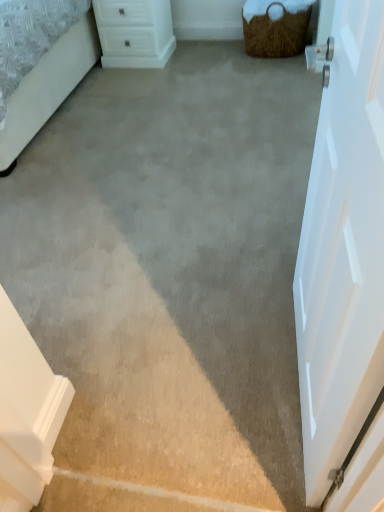
Question: Which direction should I rotate to look at white plastic chest of drawers at upper center?

Choices:
 (A) left
 (B) right

Answer: (A)

Question: From the image's perspective, is brown woven basket at upper right under white smooth door at right?

Choices:
 (A) yes
 (B) no

Answer: (B)

Question: Can you confirm if brown woven basket at upper right is smaller than white smooth door at right?

Choices:
 (A) yes
 (B) no

Answer: (B)

Question: Is white smooth door at right inside brown woven basket at upper right?

Choices:
 (A) yes
 (B) no

Answer: (B)

Question: Does brown woven basket at upper right appear on the left side of white smooth door at right?

Choices:
 (A) yes
 (B) no

Answer: (B)

Question: Is brown woven basket at upper right closer to camera compared to white smooth door at right?

Choices:
 (A) yes
 (B) no

Answer: (B)

Question: Are brown woven basket at upper right and white smooth door at right beside each other?

Choices:
 (A) no
 (B) yes

Answer: (A)

Question: Considering the relative sizes of white smooth door at right and brown woven basket at upper right in the image provided, is white smooth door at right bigger than brown woven basket at upper right?

Choices:
 (A) yes
 (B) no

Answer: (B)

Question: Does white smooth door at right appear on the left side of brown woven basket at upper right?

Choices:
 (A) no
 (B) yes

Answer: (B)

Question: Is white smooth door at right closer to the viewer compared to brown woven basket at upper right?

Choices:
 (A) yes
 (B) no

Answer: (A)

Question: Considering the relative sizes of white smooth door at right and brown woven basket at upper right in the image provided, is white smooth door at right shorter than brown woven basket at upper right?

Choices:
 (A) no
 (B) yes

Answer: (A)

Question: Can you confirm if white smooth door at right is taller than brown woven basket at upper right?

Choices:
 (A) no
 (B) yes

Answer: (B)

Question: Is white smooth door at right far away from brown woven basket at upper right?

Choices:
 (A) no
 (B) yes

Answer: (B)

Question: Is white plastic chest of drawers at upper center placed right next to white smooth door at right?

Choices:
 (A) no
 (B) yes

Answer: (A)